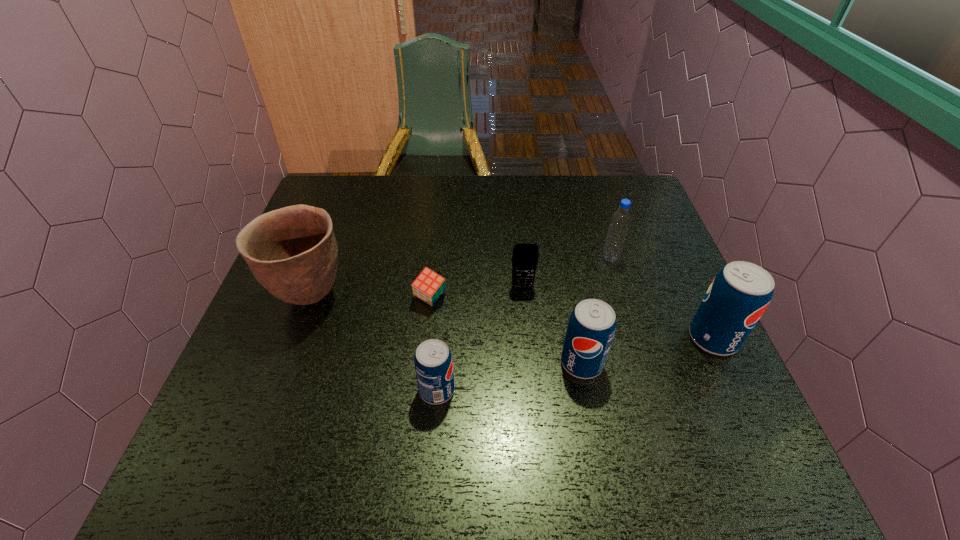
Given the evenly spaced pops in the image, where should an extra pop be added on the left to preserve the spacing? Please point to a vacant space. Please provide its 2D coordinates. Your answer should be formatted as a tuple, i.e. [(x, y)], where the tuple contains the x and y coordinates of a point satisfying the conditions above.

[(276, 420)]